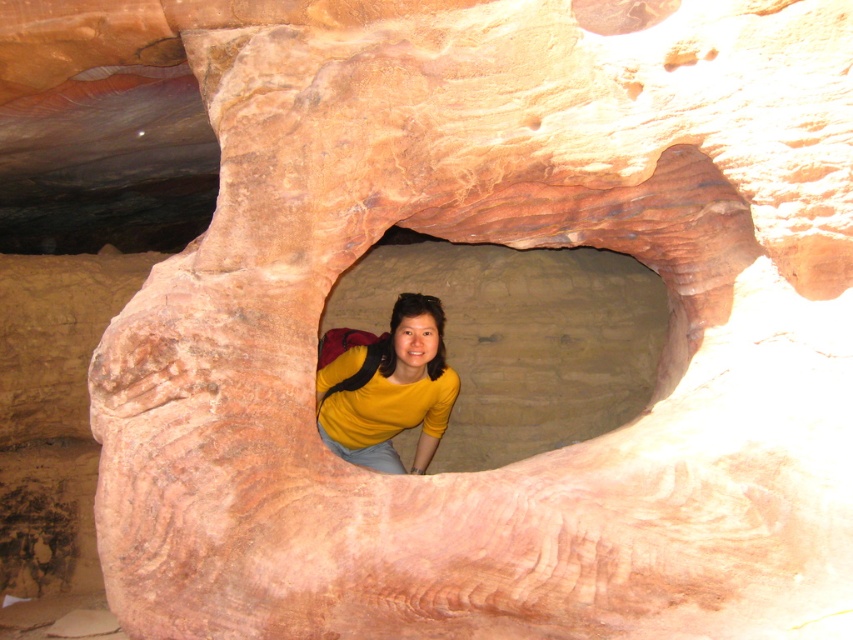
Question: Which point appears farthest from the camera in this image?

Choices:
 (A) (451, 387)
 (B) (573, 250)

Answer: (B)

Question: Can you confirm if matte yellow shirt at center is positioned above yellow matte shirt at center?

Choices:
 (A) no
 (B) yes

Answer: (B)

Question: Is matte yellow shirt at center positioned in front of yellow matte shirt at center?

Choices:
 (A) no
 (B) yes

Answer: (A)

Question: Where is matte yellow shirt at center located in relation to yellow matte shirt at center in the image?

Choices:
 (A) below
 (B) above

Answer: (B)